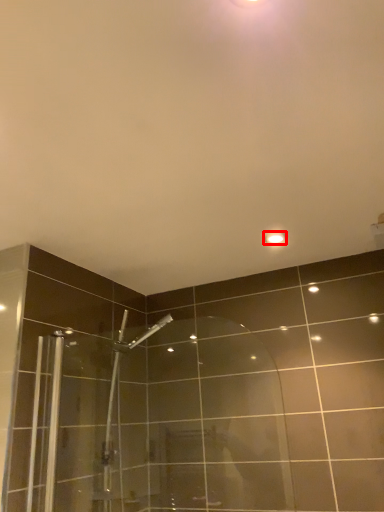
Question: From the image's perspective, what is the correct spatial positioning of light fixture (annotated by the red box) in reference to shower door?

Choices:
 (A) above
 (B) below

Answer: (A)